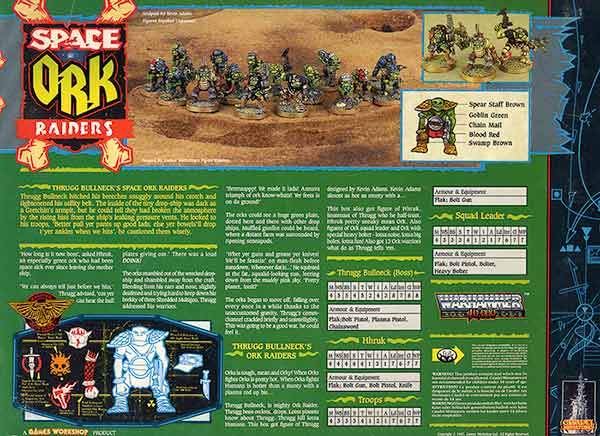
At what (x,y) coordinates should I click in order to perform the action: click on column 1. Please return your answer as a coordinate pair (x, y). This screenshot has height=436, width=600. Looking at the image, I should click on (65, 262).